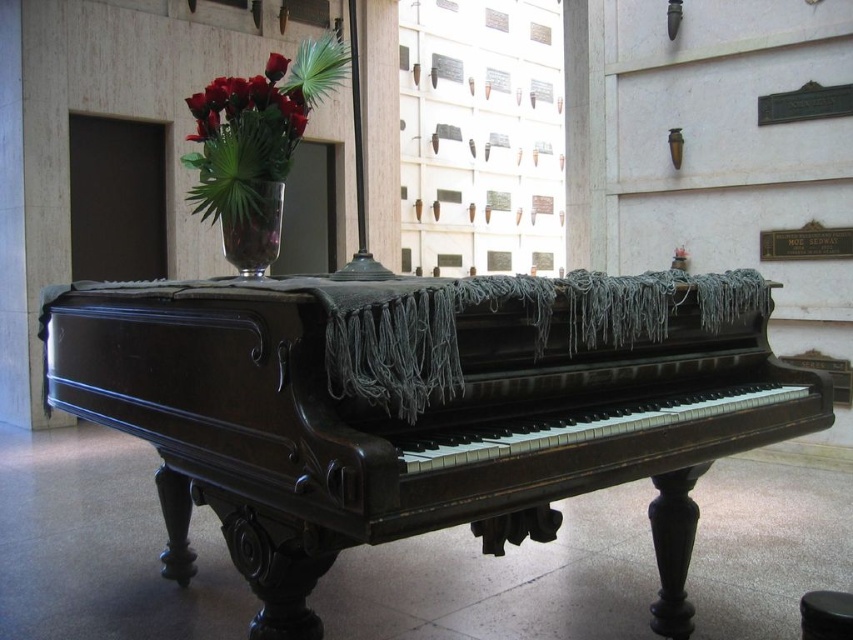
In the scene shown: Does polished dark wood piano at center have a lesser height compared to clear glass vase at upper center?

In fact, polished dark wood piano at center may be taller than clear glass vase at upper center.

Can you confirm if polished dark wood piano at center is positioned above clear glass vase at upper center?

Actually, polished dark wood piano at center is below clear glass vase at upper center.

This screenshot has width=853, height=640. I want to click on polished dark wood piano at center, so click(x=424, y=410).

Where is `polished dark wood piano at center`? The width and height of the screenshot is (853, 640). polished dark wood piano at center is located at coordinates (424, 410).

Who is lower down, shiny glass vase with roses at upper left or clear glass vase at upper center?

clear glass vase at upper center

The width and height of the screenshot is (853, 640). Describe the element at coordinates (254, 148) in the screenshot. I see `shiny glass vase with roses at upper left` at that location.

Locate an element on the screen. The width and height of the screenshot is (853, 640). shiny glass vase with roses at upper left is located at coordinates (254, 148).

Is polished dark wood piano at center positioned in front of matte glass vase at upper center?

Yes, polished dark wood piano at center is closer to the viewer.

Can you confirm if polished dark wood piano at center is shorter than matte glass vase at upper center?

Yes, polished dark wood piano at center is shorter than matte glass vase at upper center.

Is point (57, 320) less distant than point (277, 76)?

No, (57, 320) is further to viewer.

Find the location of a particular element. This screenshot has height=640, width=853. polished dark wood piano at center is located at coordinates (424, 410).